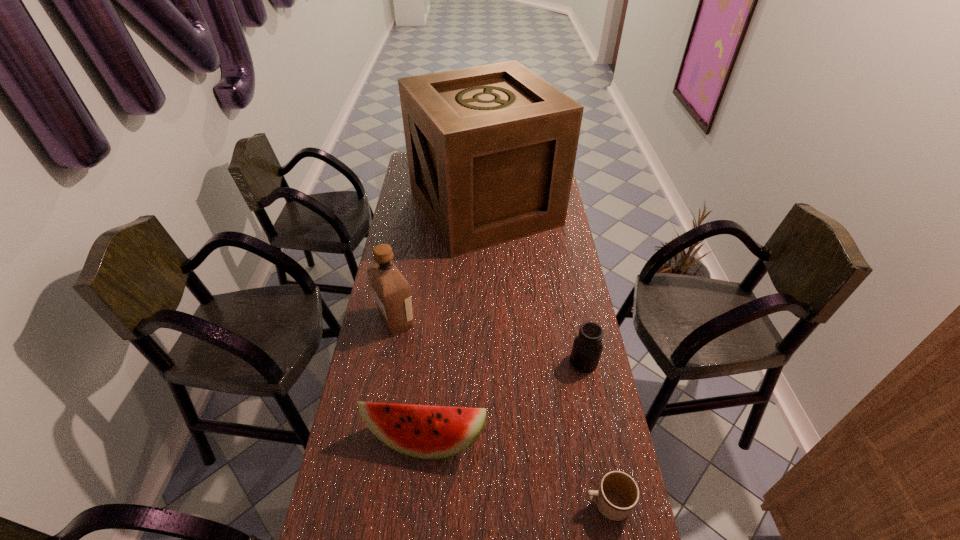
Find the location of a particular element. The width and height of the screenshot is (960, 540). free region that satisfies the following two spatial constraints: 1. on the side of the jar with the handle; 2. on the right side of the mug is located at coordinates (579, 361).

Find the location of `free space in the image that satisfies the following two spatial constraints: 1. on the front-facing side of the second farthest object; 2. on the left side of the third nearest object`. free space in the image that satisfies the following two spatial constraints: 1. on the front-facing side of the second farthest object; 2. on the left side of the third nearest object is located at coordinates (389, 361).